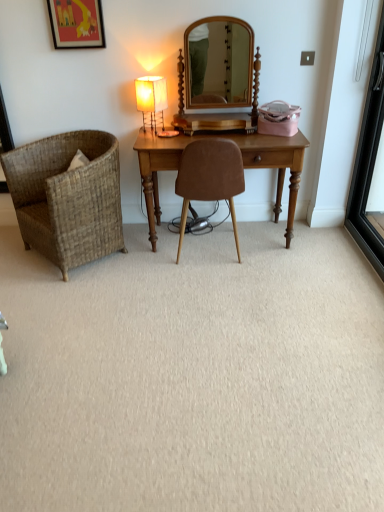
Where is `vacant space that is to the left of brown suede chair at center, marked as the first chair in a right-to-left arrangement`? The image size is (384, 512). vacant space that is to the left of brown suede chair at center, marked as the first chair in a right-to-left arrangement is located at coordinates (152, 262).